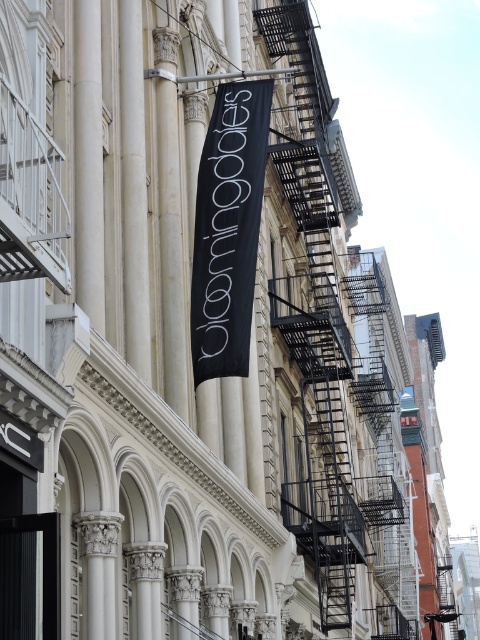
You are an architect evaluating the building facade. You need to determine which object occupies more space on the wall between the black metal fire escape at upper right and the black fabric banner at center. Based on the scene, which one is larger?

The black metal fire escape at upper right has a larger size compared to the black fabric banner at center, so it occupies more space on the wall.

You are standing in front of the building and want to reach the black metal fire escape at upper right. Which direction should you move relative to the black fabric banner at center?

The black metal fire escape at upper right is below the black fabric banner at center, so you should move downward from the banner to reach the fire escape.